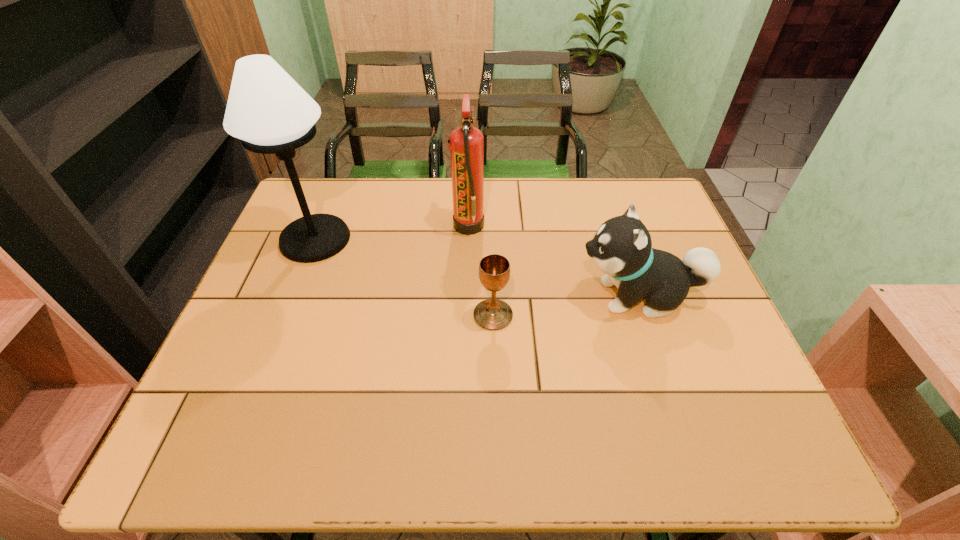
Locate an element on the screen. This screenshot has width=960, height=540. the tallest object is located at coordinates (269, 112).

Identify the location of table lamp. (269, 112).

I want to click on the second tallest object, so click(x=466, y=146).

This screenshot has height=540, width=960. Find the location of `the rightmost object`. the rightmost object is located at coordinates (622, 248).

The image size is (960, 540). Find the location of `puppy`. puppy is located at coordinates (622, 248).

At what (x,y) coordinates should I click in order to perform the action: click on chalice. Please return your answer as a coordinate pair (x, y). Image resolution: width=960 pixels, height=540 pixels. Looking at the image, I should click on (494, 270).

At what (x,y) coordinates should I click in order to perform the action: click on free space located 0.220m on the front of the table lamp. Please return your answer as a coordinate pair (x, y). Image resolution: width=960 pixels, height=540 pixels. Looking at the image, I should click on (279, 332).

The height and width of the screenshot is (540, 960). In order to click on free location located 0.210m with the nozzle pointing from the back of the second tallest object in this screenshot , I will do `click(556, 226)`.

Identify the location of free location located 0.290m at the face of the rightmost object. The width and height of the screenshot is (960, 540). (458, 296).

Identify the location of free spot located 0.310m at the face of the rightmost object. The height and width of the screenshot is (540, 960). (450, 296).